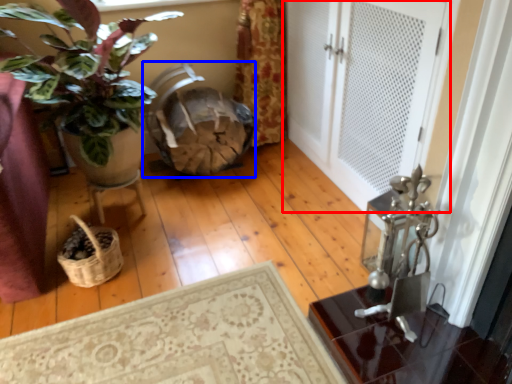
Question: Which object appears farthest to the camera in this image, door (highlighted by a red box) or rocking chair (highlighted by a blue box)?

Choices:
 (A) door
 (B) rocking chair

Answer: (B)